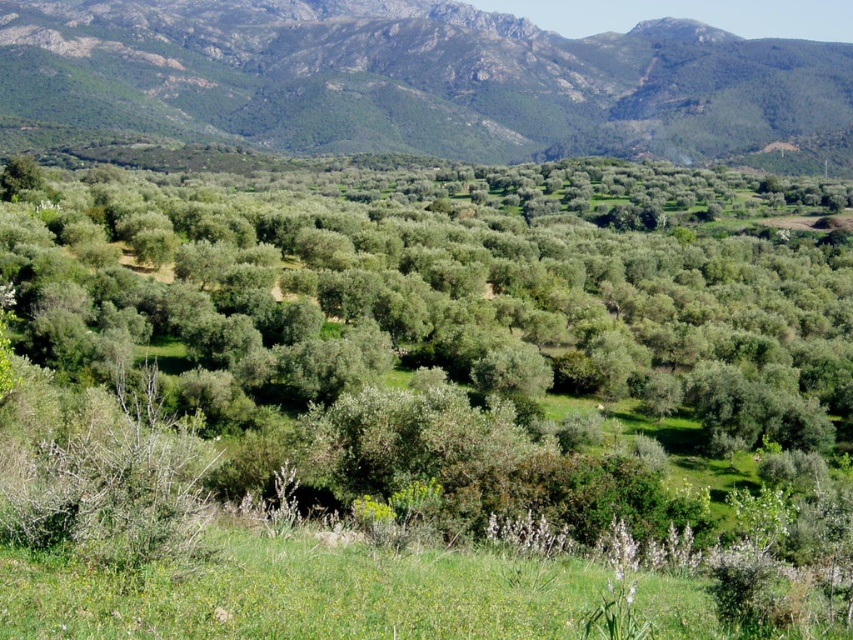
Measure the distance between green leafy tree at center and green rocky mountain range at upper center.

A distance of 308.44 meters exists between green leafy tree at center and green rocky mountain range at upper center.

Between point (172, 244) and point (190, 116), which one is positioned in front?

Point (172, 244)

In order to click on green leafy tree at center in this screenshot , I will do 436,328.

Does green leafy tree at center appear under green grassy at lower center?

Actually, green leafy tree at center is above green grassy at lower center.

Does green leafy tree at center lie behind green grassy at lower center?

Yes, it is behind green grassy at lower center.

Who is more forward, (169, 262) or (486, 612)?

Positioned in front is point (486, 612).

The image size is (853, 640). In order to click on green leafy tree at center in this screenshot , I will do `click(436, 328)`.

Does green rocky mountain range at upper center have a greater height compared to green grassy at lower center?

Yes, green rocky mountain range at upper center is taller than green grassy at lower center.

Is green rocky mountain range at upper center smaller than green grassy at lower center?

No.

Describe the element at coordinates (415, 77) in the screenshot. I see `green rocky mountain range at upper center` at that location.

The image size is (853, 640). In order to click on green rocky mountain range at upper center in this screenshot , I will do `click(415, 77)`.